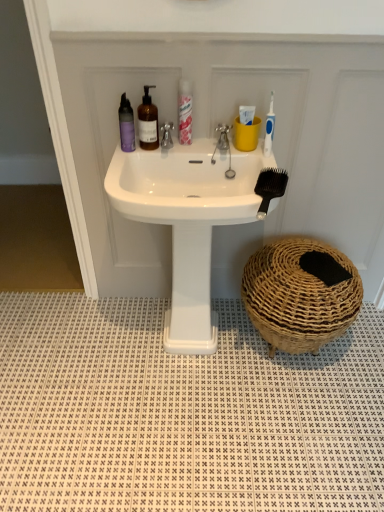
This screenshot has width=384, height=512. In order to click on free point to the right of translucent pink spray can at upper center in this screenshot , I will do `click(215, 144)`.